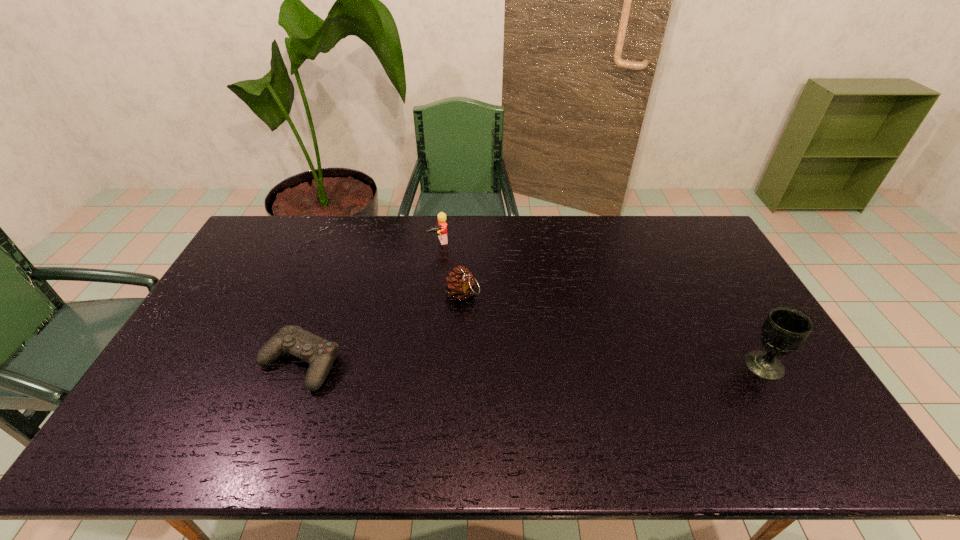
In the image, there is a desktop. Where is `blank space at the near edge`? blank space at the near edge is located at coordinates (347, 398).

The height and width of the screenshot is (540, 960). In order to click on vacant space at the right edge of the desktop in this screenshot , I will do `click(796, 373)`.

I want to click on free space at the far left corner of the desktop, so click(x=289, y=233).

The width and height of the screenshot is (960, 540). Find the location of `free space that is in between the pinecone and the control`. free space that is in between the pinecone and the control is located at coordinates (381, 328).

The image size is (960, 540). Find the location of `empty space between the shortest object and the pinecone`. empty space between the shortest object and the pinecone is located at coordinates (381, 328).

Where is `empty location between the Lego and the pinecone`? This screenshot has height=540, width=960. empty location between the Lego and the pinecone is located at coordinates (450, 268).

Where is `vacant area between the tallest object and the third object from left to right`? Image resolution: width=960 pixels, height=540 pixels. vacant area between the tallest object and the third object from left to right is located at coordinates (613, 329).

The width and height of the screenshot is (960, 540). Identify the location of vacant space that is in between the pinecone and the farthest object. (450, 268).

Locate an element on the screen. The image size is (960, 540). blank region between the farthest object and the rightmost object is located at coordinates (601, 303).

Locate an element on the screen. Image resolution: width=960 pixels, height=540 pixels. free space between the control and the Lego is located at coordinates (369, 303).